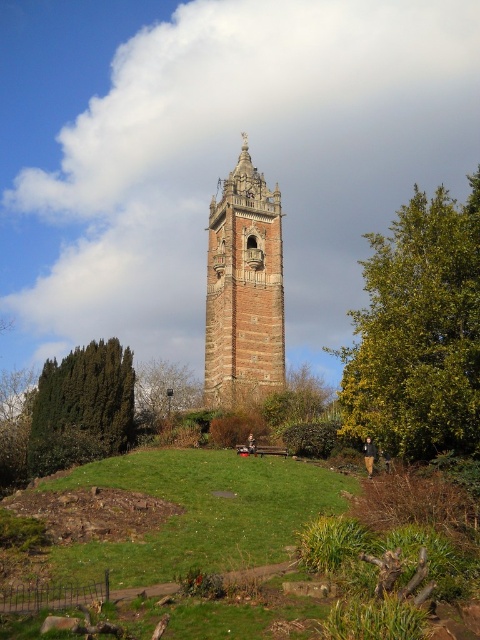
Question: Which point is farther from the camera taking this photo?

Choices:
 (A) (462, 449)
 (B) (113, 449)

Answer: (B)

Question: Does green leafy tree at center-right appear over green leafy tree at lower left?

Choices:
 (A) no
 (B) yes

Answer: (B)

Question: Is green leafy tree at center-right further to camera compared to green leafy tree at center?

Choices:
 (A) no
 (B) yes

Answer: (A)

Question: Which object is closer to the camera taking this photo?

Choices:
 (A) green leafy tree at center-right
 (B) green leafy tree at center
 (C) brick stonework clock tower at center
 (D) green leafy tree at lower left

Answer: (A)

Question: Which point is closer to the camera?

Choices:
 (A) green leafy tree at center-right
 (B) green leafy tree at center
 (C) green leafy tree at lower left

Answer: (A)

Question: Is green leafy tree at lower left to the right of green leafy tree at center from the viewer's perspective?

Choices:
 (A) yes
 (B) no

Answer: (B)